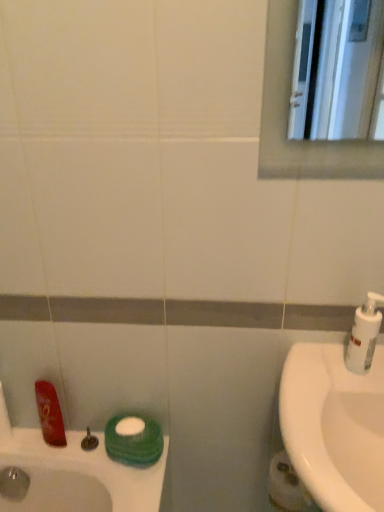
Describe the element at coordinates (89, 441) in the screenshot. This screenshot has height=512, width=384. I see `matte silver faucet at lower left` at that location.

In order to face white matte toilet paper at lower right, should I rotate leftwards or rightwards?

A 13.319 degree turn to the right will do.

Locate an element on the screen. Image resolution: width=384 pixels, height=512 pixels. white plastic soap dispenser at right is located at coordinates (364, 334).

Is white matte toilet paper at lower right completely or partially inside white plastic soap dispenser at right?

Definitely not — white matte toilet paper at lower right is not inside white plastic soap dispenser at right.

Are white plastic soap dispenser at right and white matte toilet paper at lower right located far from each other?

No, white plastic soap dispenser at right is not far away from white matte toilet paper at lower right.

Looking at the image, does white plastic soap dispenser at right seem bigger or smaller compared to white matte toilet paper at lower right?

In the image, white plastic soap dispenser at right appears to be smaller than white matte toilet paper at lower right.

I want to click on plumbing fixture above the white matte toilet paper at lower right (from the image's perspective), so click(89, 441).

Is point (82, 443) farther from viewer compared to point (271, 484)?

Yes.

Considering the relative sizes of matte silver faucet at lower left and white matte toilet paper at lower right in the image provided, is matte silver faucet at lower left smaller than white matte toilet paper at lower right?

Correct, matte silver faucet at lower left occupies less space than white matte toilet paper at lower right.

Is white matte toilet paper at lower right facing away from white plastic soap dispenser at right?

white matte toilet paper at lower right is not turned away from white plastic soap dispenser at right.

Would you say white matte toilet paper at lower right is outside white plastic soap dispenser at right?

Yes.

From the image's perspective, which one is positioned lower, white matte toilet paper at lower right or white plastic soap dispenser at right?

white matte toilet paper at lower right appears lower in the image.

From a real-world perspective, is matte silver faucet at lower left physically located above or below white plastic soap dispenser at right?

From a real-world perspective, matte silver faucet at lower left is physically below white plastic soap dispenser at right.

Is matte silver faucet at lower left not close to white plastic soap dispenser at right?

That's not correct — matte silver faucet at lower left is a little close to white plastic soap dispenser at right.

Is point (94, 447) positioned behind point (366, 301)?

Yes.

Considering the sizes of objects matte silver faucet at lower left and white plastic soap dispenser at right in the image provided, who is wider, matte silver faucet at lower left or white plastic soap dispenser at right?

With larger width is white plastic soap dispenser at right.

Who is taller, white glossy sink at right or matte silver faucet at lower left?

white glossy sink at right.

From a real-world perspective, which is physically below, white glossy sink at right or matte silver faucet at lower left?

From a 3D spatial view, matte silver faucet at lower left is below.

From the image's perspective, is white glossy sink at right beneath matte silver faucet at lower left?

Actually, white glossy sink at right appears above matte silver faucet at lower left in the image.

Does point (351, 393) appear closer or farther from the camera than point (85, 448)?

Clearly, point (351, 393) is closer to the camera than point (85, 448).

The height and width of the screenshot is (512, 384). What are the coordinates of `toilet paper located behind the white glossy sink at right` in the screenshot? It's located at pyautogui.click(x=286, y=485).

Would you say white glossy sink at right is to the left or to the right of white matte toilet paper at lower right in the picture?

Based on their positions, white glossy sink at right is located to the right of white matte toilet paper at lower right.

From a real-world perspective, is white glossy sink at right on top of white matte toilet paper at lower right?

Yes, from a real-world perspective, white glossy sink at right is on top of white matte toilet paper at lower right.

Considering the sizes of objects white glossy sink at right and white matte toilet paper at lower right in the image provided, who is taller, white glossy sink at right or white matte toilet paper at lower right?

Standing taller between the two is white glossy sink at right.

Which is correct: matte silver faucet at lower left is inside white glossy sink at right, or outside of it?

matte silver faucet at lower left is not inside white glossy sink at right, it's outside.

Are matte silver faucet at lower left and white glossy sink at right making contact?

They are not placed beside each other.

This screenshot has width=384, height=512. What are the coordinates of `soap dispenser in front of the white matte toilet paper at lower right` in the screenshot? It's located at (364, 334).

The image size is (384, 512). What are the coordinates of `plumbing fixture above the white matte toilet paper at lower right (from the image's perspective)` in the screenshot? It's located at (89, 441).

When comparing their distances from white matte toilet paper at lower right, does matte silver faucet at lower left or white glossy sink at right seem further?

The object further to white matte toilet paper at lower right is matte silver faucet at lower left.

From the image, which object appears to be nearer to matte silver faucet at lower left, white plastic soap dispenser at right or white glossy sink at right?

Among the two, white glossy sink at right is located nearer to matte silver faucet at lower left.

From the image, which object appears to be farther from matte silver faucet at lower left, white plastic soap dispenser at right or white matte toilet paper at lower right?

Based on the image, white plastic soap dispenser at right appears to be further to matte silver faucet at lower left.

From the image, which object appears to be farther from white glossy sink at right, white matte toilet paper at lower right or white plastic soap dispenser at right?

white matte toilet paper at lower right lies further to white glossy sink at right than the other object.

Looking at this image, considering their positions, is white matte toilet paper at lower right positioned closer to white plastic soap dispenser at right than matte silver faucet at lower left?

Based on the image, white matte toilet paper at lower right appears to be nearer to white plastic soap dispenser at right.

Looking at the image, which one is located closer to white matte toilet paper at lower right, white glossy sink at right or matte silver faucet at lower left?

white glossy sink at right is positioned closer to the anchor white matte toilet paper at lower right.

When comparing their distances from white plastic soap dispenser at right, does matte silver faucet at lower left or white matte toilet paper at lower right seem closer?

white matte toilet paper at lower right is closer to white plastic soap dispenser at right.

From the image, which object appears to be nearer to white glossy sink at right, matte silver faucet at lower left or white plastic soap dispenser at right?

white plastic soap dispenser at right is positioned closer to the anchor white glossy sink at right.

The height and width of the screenshot is (512, 384). What are the coordinates of `toilet paper located between matte silver faucet at lower left and white plastic soap dispenser at right in the left-right direction` in the screenshot? It's located at (286, 485).

Identify the location of toilet paper situated between matte silver faucet at lower left and white glossy sink at right from left to right. (286, 485).

The height and width of the screenshot is (512, 384). I want to click on sink between matte silver faucet at lower left and white plastic soap dispenser at right from left to right, so click(x=334, y=426).

Where is `sink between white plastic soap dispenser at right and white matte toilet paper at lower right from top to bottom`? The image size is (384, 512). sink between white plastic soap dispenser at right and white matte toilet paper at lower right from top to bottom is located at coordinates (334, 426).